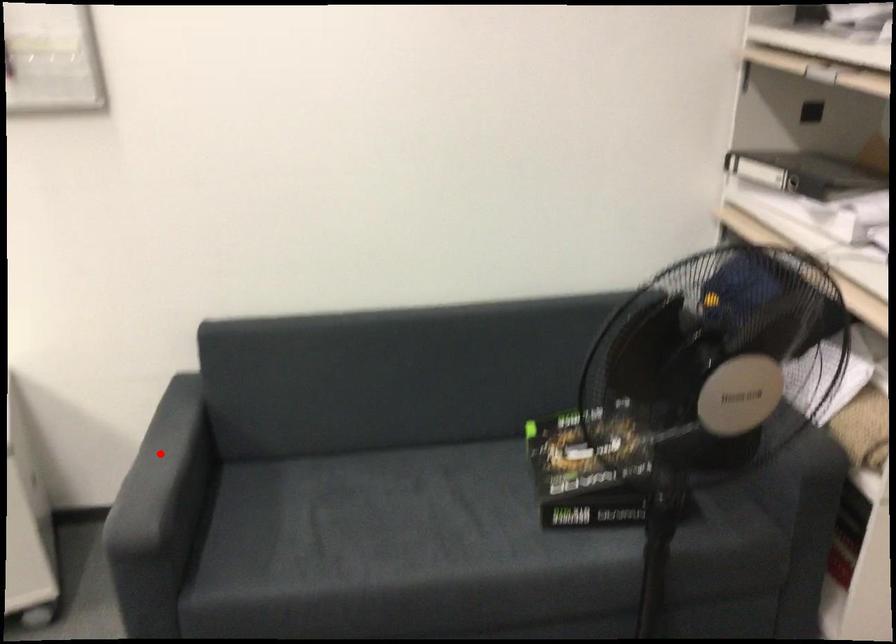
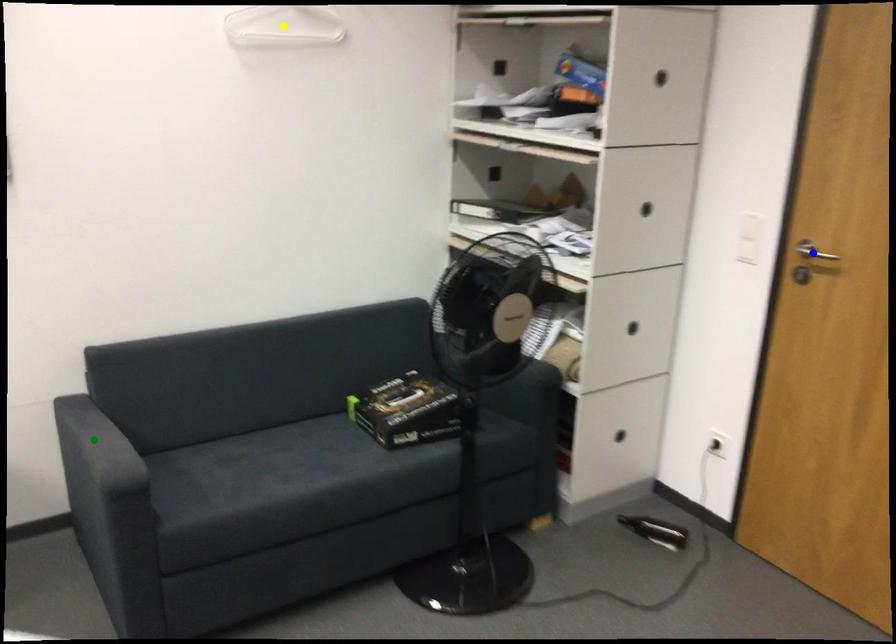
Question: I am providing you with two images of the same scene from different viewpoints. A red point is marked on the first image. You are given multiple points on the second image. Can you choose the point in image 2 that corresponds to the point in image 1?

Choices:
 (A) yellow point
 (B) blue point
 (C) green point

Answer: (C)